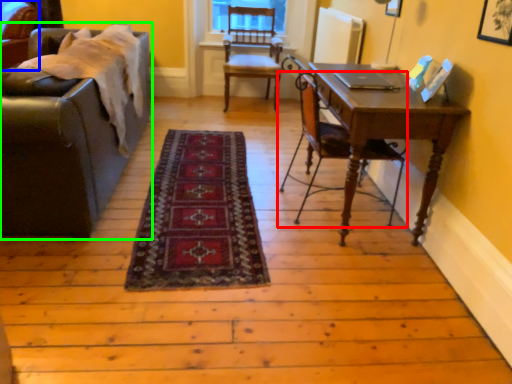
Question: Which is farther away from chair (highlighted by a red box)? chair (highlighted by a blue box) or studio couch (highlighted by a green box)?

Choices:
 (A) chair
 (B) studio couch

Answer: (A)